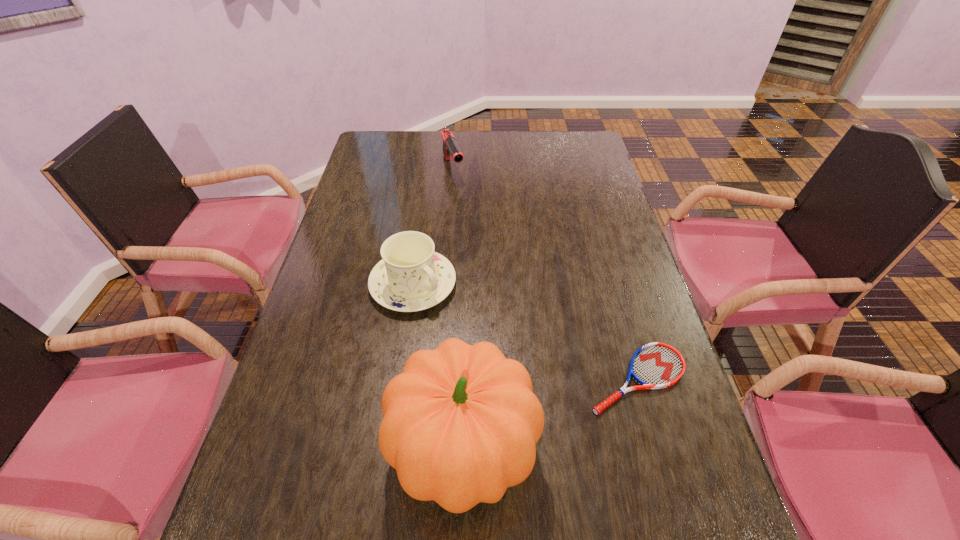
Where is `vacant space on the desktop that is between the pumpkin and the rightmost object and is positioned at the aiming end of the farthest object`? The height and width of the screenshot is (540, 960). vacant space on the desktop that is between the pumpkin and the rightmost object and is positioned at the aiming end of the farthest object is located at coordinates (566, 408).

The width and height of the screenshot is (960, 540). What are the coordinates of `free space on the desktop that is between the pumpkin and the tennis racket and is positioned on the handle side of the chinaware` in the screenshot? It's located at (556, 413).